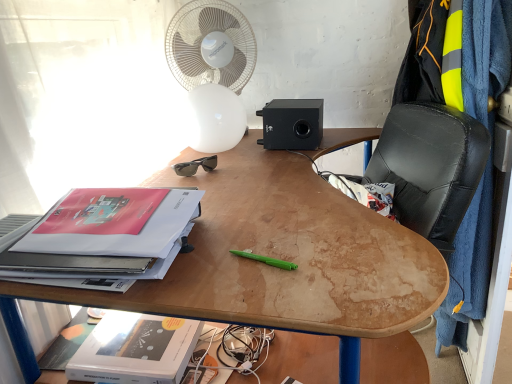
At what (x,y) coordinates should I click in order to perform the action: click on vacant space that's between green plastic pen at center and black plastic sunglasses at upper center. Please return your answer as a coordinate pair (x, y). This screenshot has width=512, height=384. Looking at the image, I should click on (229, 205).